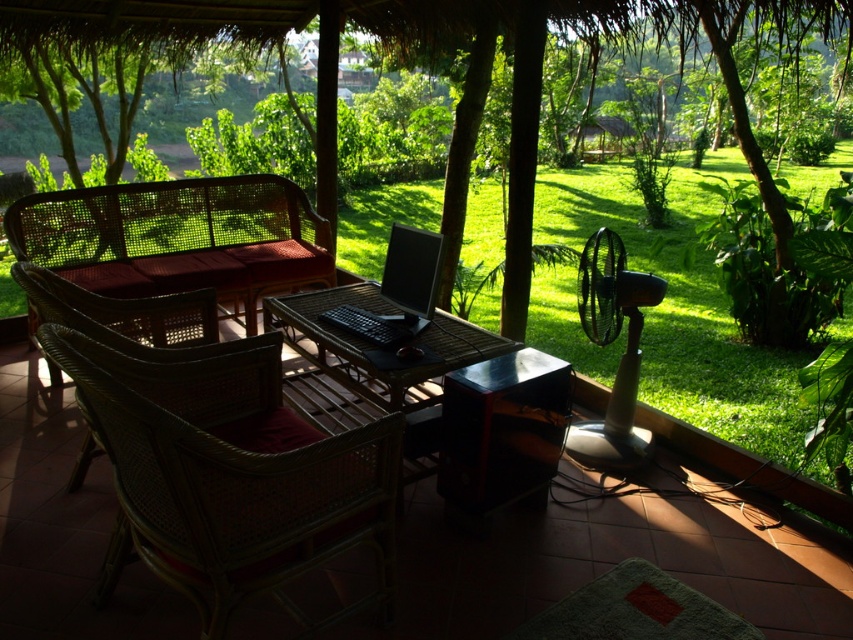
Question: Does green leafy tree at center have a lesser width compared to woven wood table at center?

Choices:
 (A) yes
 (B) no

Answer: (B)

Question: Does woven rattan chair at center have a greater width compared to green leafy tree at center?

Choices:
 (A) yes
 (B) no

Answer: (B)

Question: Which point is farther to the camera?

Choices:
 (A) (323, 321)
 (B) (154, 24)
 (C) (161, 560)

Answer: (B)

Question: Can you confirm if green leafy tree at center is positioned to the left of woven rattan chair at left?

Choices:
 (A) no
 (B) yes

Answer: (A)

Question: Which point is farther from the camera taking this photo?

Choices:
 (A) (428, 19)
 (B) (257, 452)
 (C) (381, 321)

Answer: (A)

Question: Among these objects, which one is nearest to the camera?

Choices:
 (A) green leafy tree at center
 (B) black matte laptop at center
 (C) woven rattan chair at left
 (D) woven wood table at center

Answer: (C)